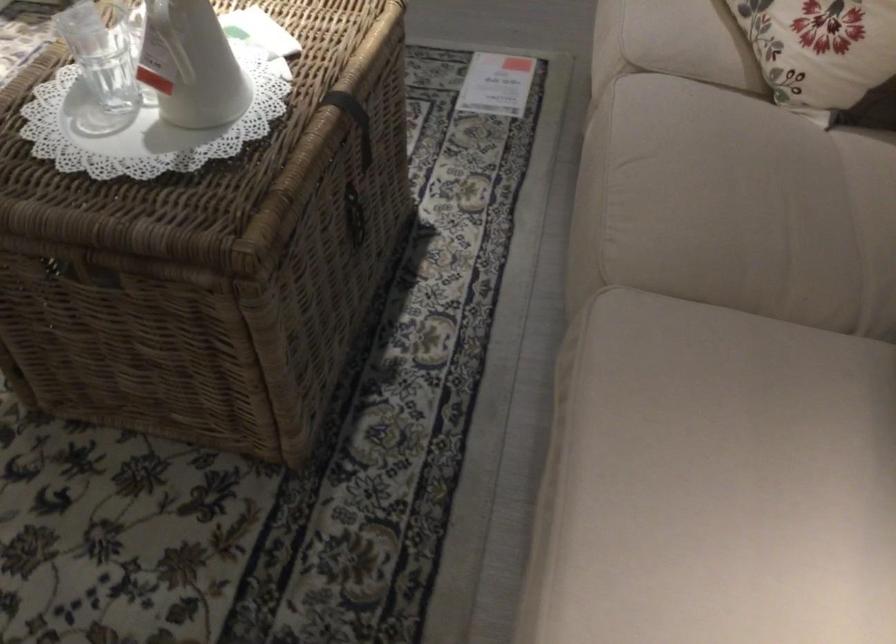
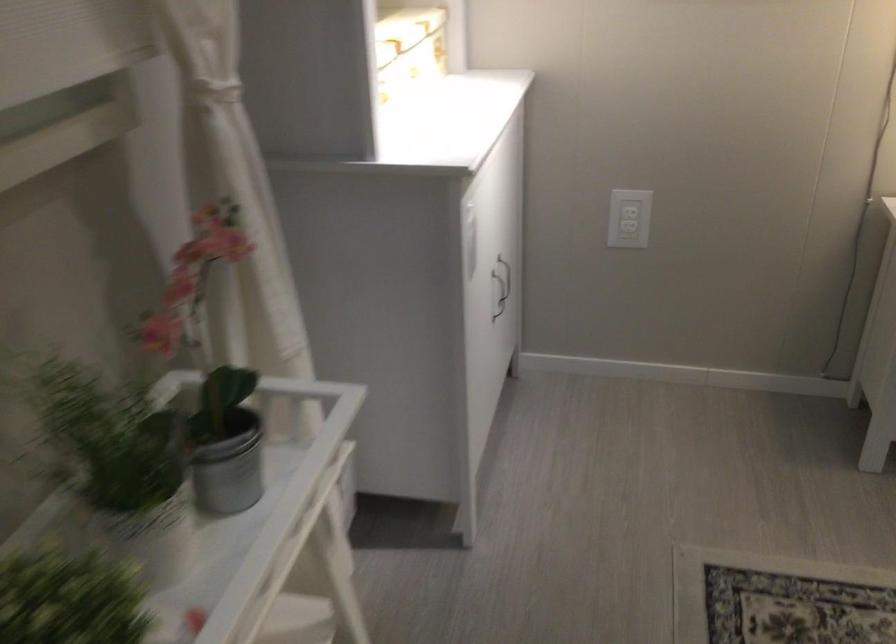
How did the camera likely rotate?

The camera rotated toward left-down.